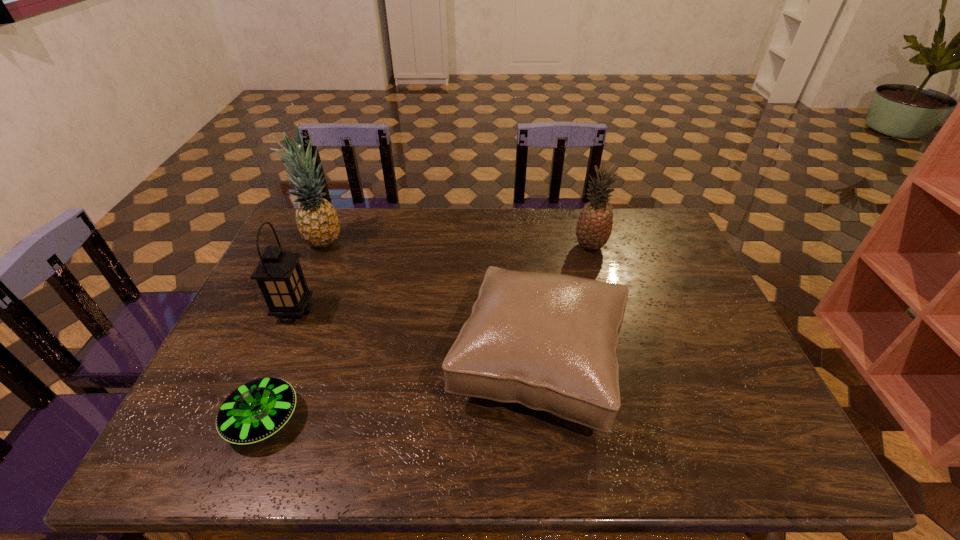
Where is `blank space located 0.230m on the back of the shortest object`? Image resolution: width=960 pixels, height=540 pixels. blank space located 0.230m on the back of the shortest object is located at coordinates (304, 317).

Where is `cushion present at the near edge`? cushion present at the near edge is located at coordinates (548, 341).

The image size is (960, 540). In order to click on saucer at the near edge in this screenshot , I will do point(256,410).

This screenshot has width=960, height=540. I want to click on pineapple that is at the left edge, so click(317, 221).

Identify the location of lantern that is positioned at the left edge. [279, 275].

This screenshot has width=960, height=540. Find the location of `saucer present at the left edge`. saucer present at the left edge is located at coordinates (256, 410).

What are the coordinates of `object located at the far left corner` in the screenshot? It's located at (317, 221).

I want to click on object located at the near left corner, so click(x=256, y=410).

Locate an element on the screen. Image resolution: width=960 pixels, height=540 pixels. vacant area at the far edge is located at coordinates (436, 238).

You are a GUI agent. You are given a task and a screenshot of the screen. Output one action in this format:
    pyautogui.click(x=<x>, y=<y>)
    Task: Click on the vacant space at the near edge of the desktop
    This screenshot has height=540, width=960.
    Given the screenshot: What is the action you would take?
    pyautogui.click(x=568, y=436)